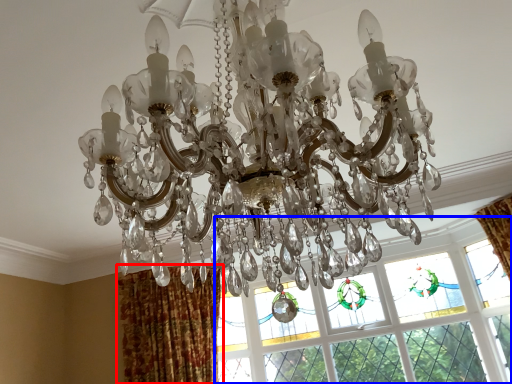
Question: Among these objects, which one is farthest to the camera, curtain (highlighted by a red box) or window (highlighted by a blue box)?

Choices:
 (A) curtain
 (B) window

Answer: (B)